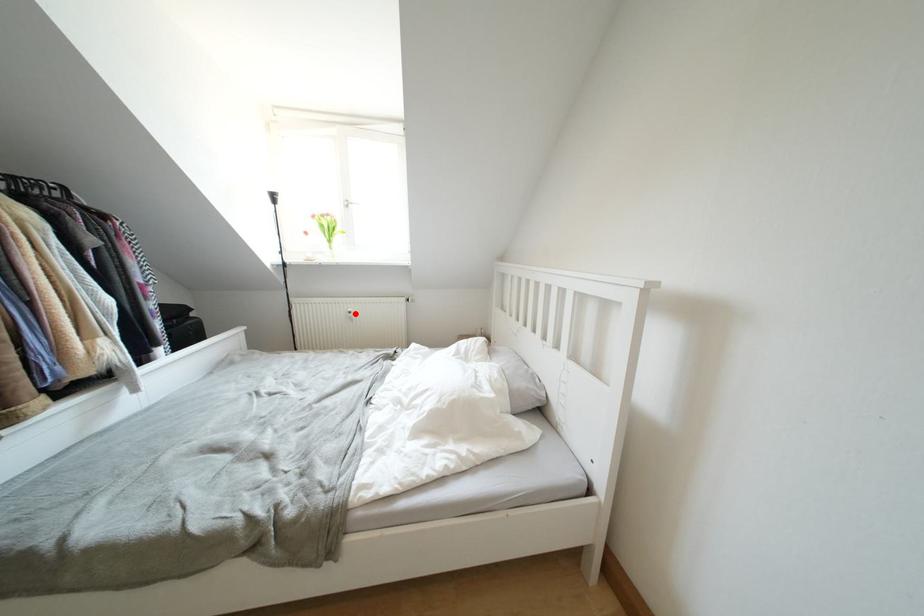
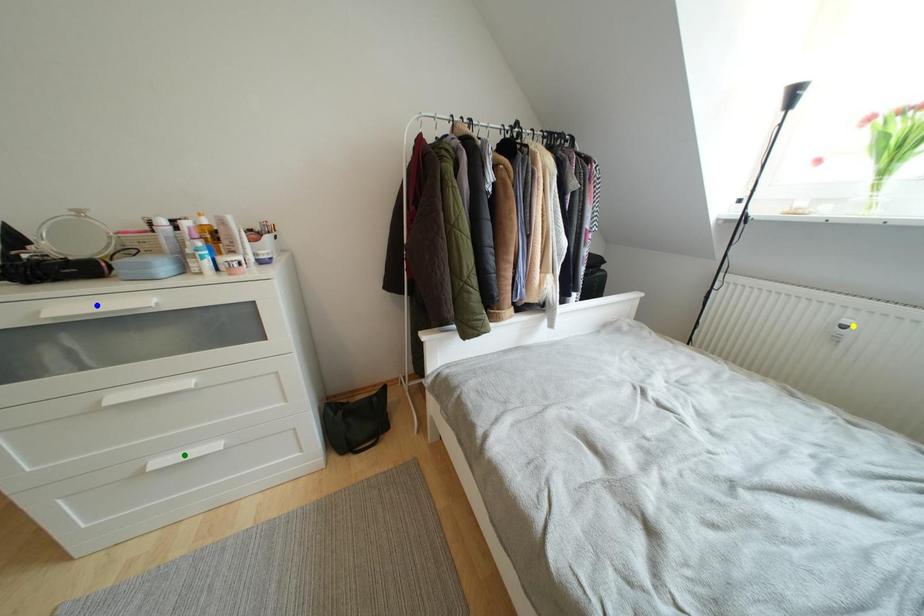
Question: I am providing you with two images of the same scene from different viewpoints. A red point is marked on the first image. You are given multiple points on the second image. Which mark in image 2 goes with the point in image 1?

Choices:
 (A) blue point
 (B) green point
 (C) yellow point

Answer: (C)